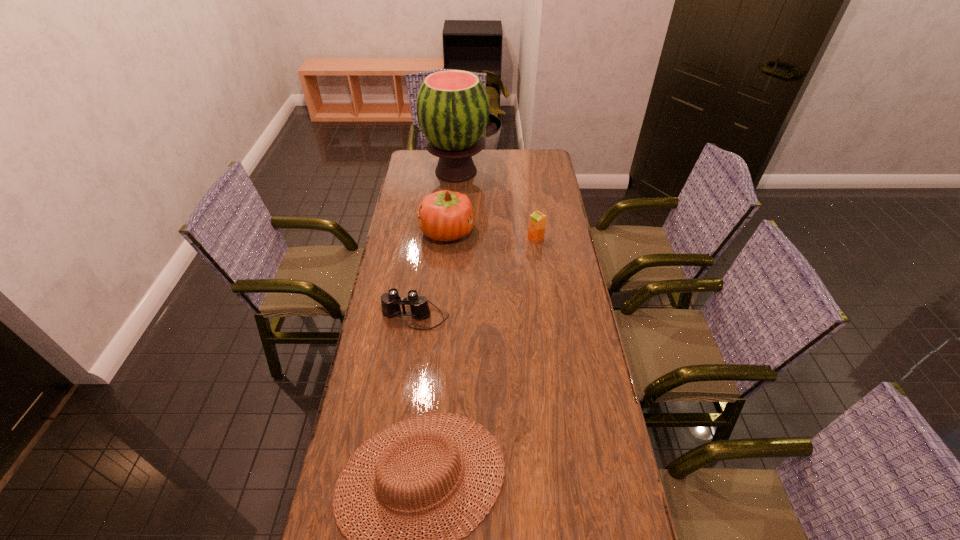
In order to click on the tallest object in this screenshot , I will do `click(452, 106)`.

Where is `watermelon`? The height and width of the screenshot is (540, 960). watermelon is located at coordinates (452, 106).

I want to click on the second tallest object, so click(444, 215).

I want to click on the rightmost object, so click(x=537, y=223).

Where is `the fourth farthest object`? The width and height of the screenshot is (960, 540). the fourth farthest object is located at coordinates (390, 302).

At what (x,y) coordinates should I click in order to perform the action: click on free space located on the front of the farthest object. Please return your answer as a coordinate pair (x, y). The image size is (960, 540). Looking at the image, I should click on (454, 200).

The width and height of the screenshot is (960, 540). I want to click on free space located 0.150m on the side of the fourth shortest object with the cute face, so click(x=510, y=232).

Where is `vacant space located on the front of the rightmost object`? vacant space located on the front of the rightmost object is located at coordinates (546, 313).

Find the location of a particular element. The image size is (960, 540). vacant space located 0.310m on the back of the binoculars is located at coordinates (424, 246).

The height and width of the screenshot is (540, 960). Find the location of `object that is at the far edge`. object that is at the far edge is located at coordinates coord(452,106).